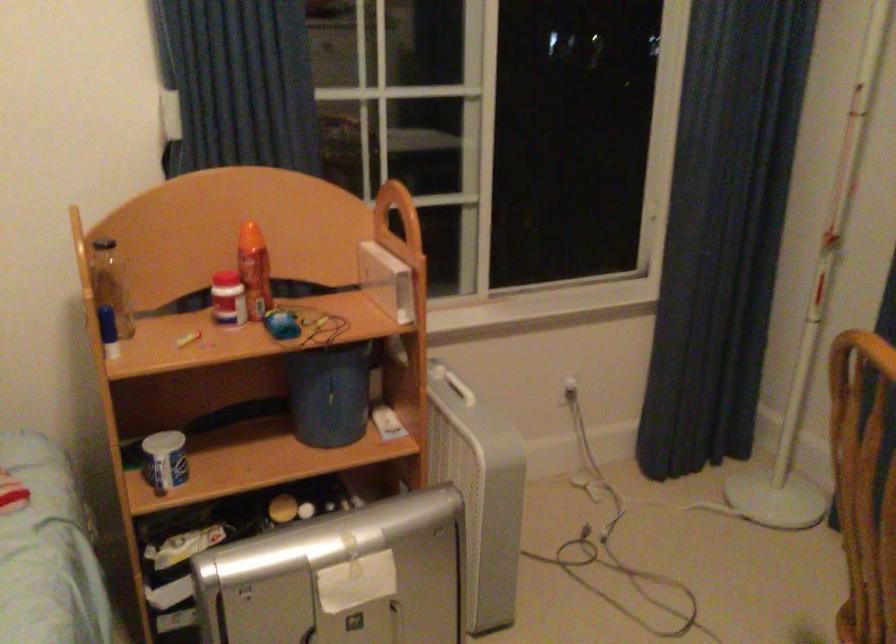
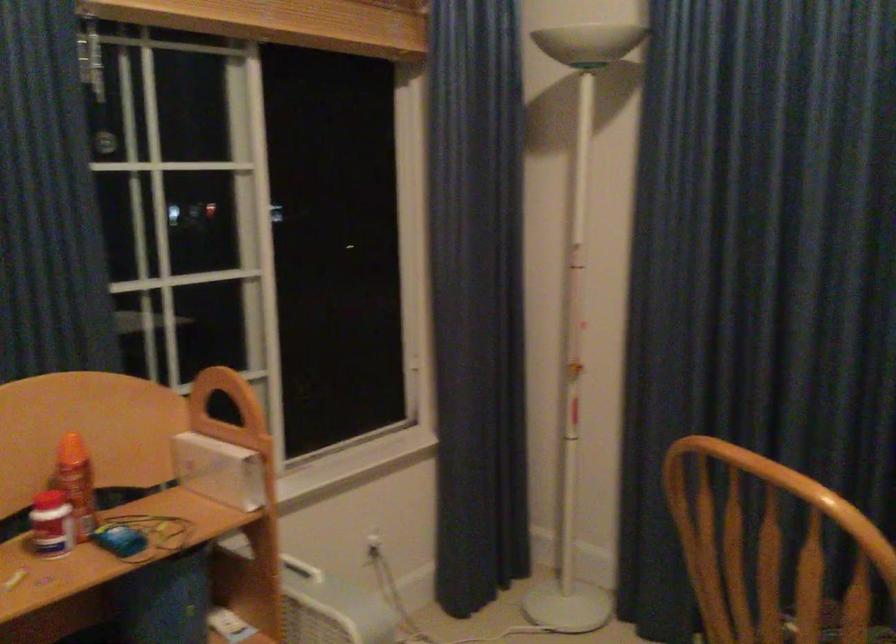
Question: What movement of the cameraman would produce the second image?

Choices:
 (A) Left
 (B) Right
 (C) Forward
 (D) Backward

Answer: (A)